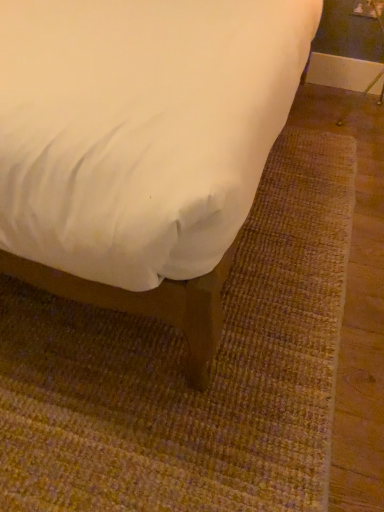
The height and width of the screenshot is (512, 384). What do you see at coordinates (141, 146) in the screenshot? I see `white fabric bed at lower left` at bounding box center [141, 146].

Find the location of a particular element. The width and height of the screenshot is (384, 512). white fabric bed at lower left is located at coordinates (141, 146).

This screenshot has height=512, width=384. Identify the location of white fabric bed at lower left. (141, 146).